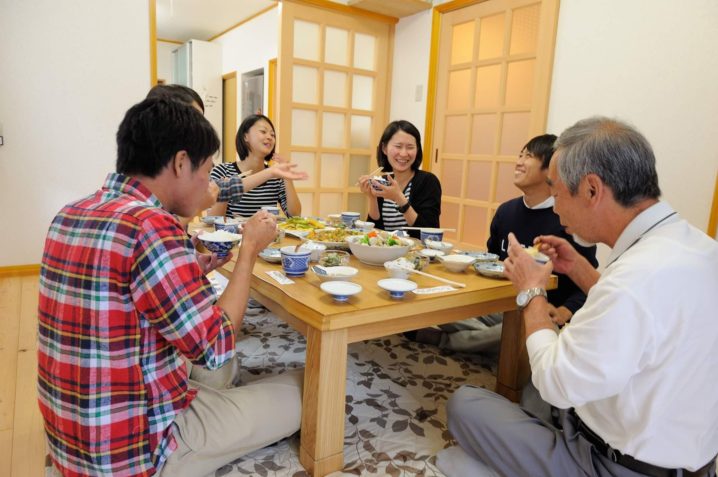
At what (x,y) coordinates should I click in order to perform the action: click on white wall. Please return your answer as a coordinate pair (x, y). Image resolution: width=718 pixels, height=477 pixels. Looking at the image, I should click on (70, 100), (250, 47), (400, 64), (638, 91).